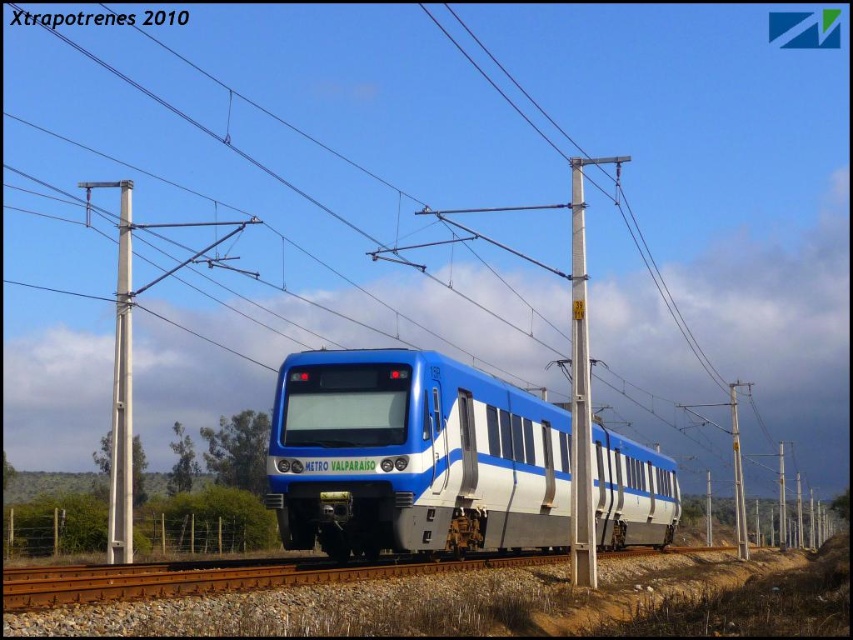
You are standing on the platform waiting for the train. You notice two points marked on the tracks ahead. The first point is at coordinates point (447, 451) and the second is at point (119, 285). Which point is nearer to you?

Point (447, 451) is closer to the viewer than point (119, 285).